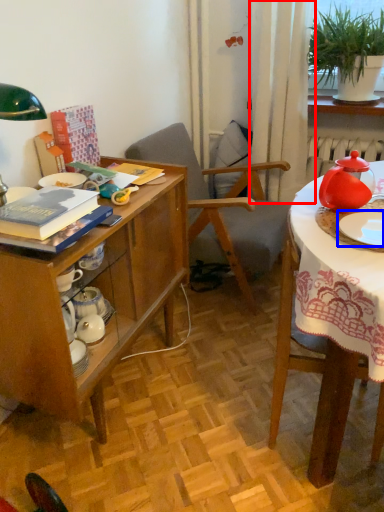
Question: Which of the following is the closest to the observer, curtain (highlighted by a red box) or tableware (highlighted by a blue box)?

Choices:
 (A) curtain
 (B) tableware

Answer: (B)